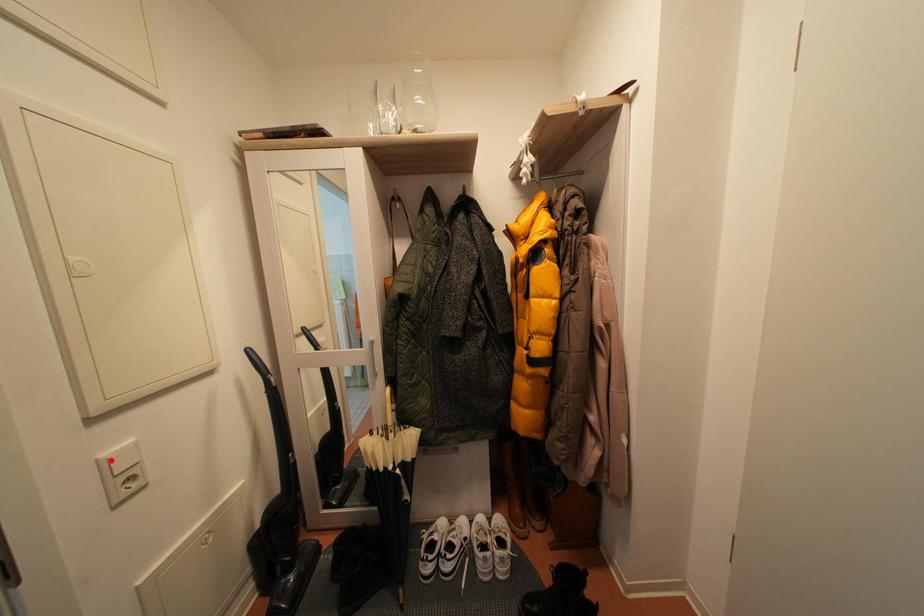
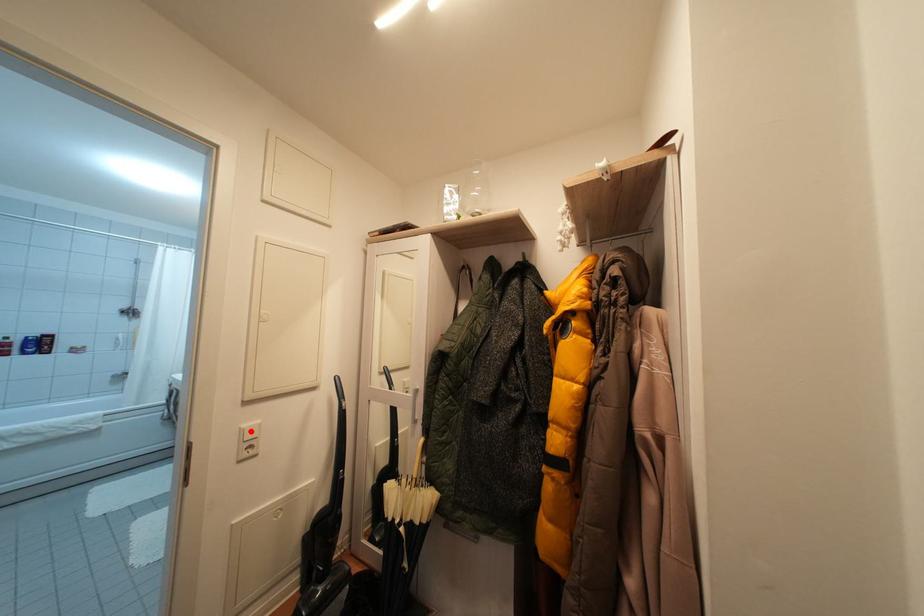
I am providing you with two images of the same scene from different viewpoints. A red point is marked on the first image and another point is marked on the second image. Is the marked point in image1 the same physical position as the marked point in image2?

Yes